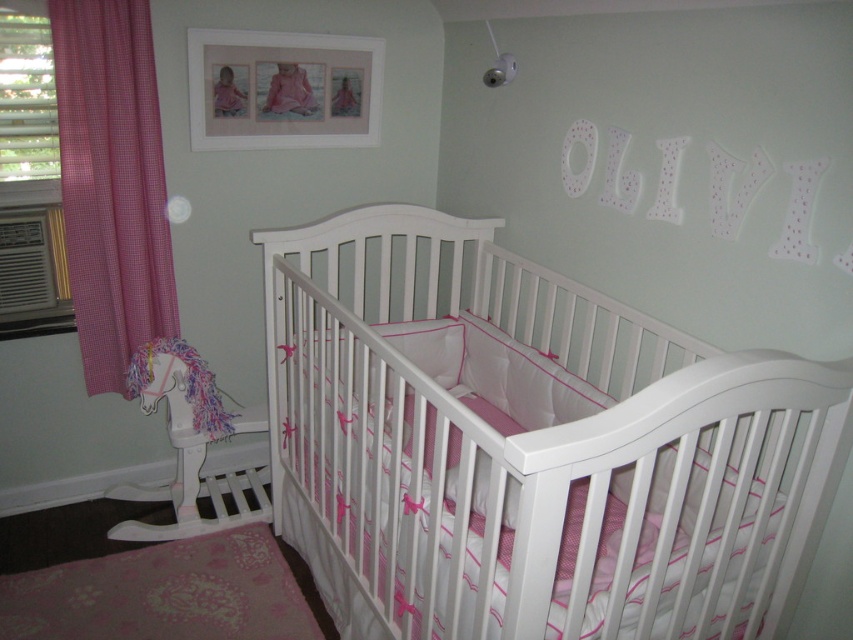
Who is lower down, white glossy crib at center or pink gingham curtain at left?

Positioned lower is white glossy crib at center.

Does point (752, 611) come in front of point (96, 374)?

Yes, it is.

Where is `white glossy crib at center`? white glossy crib at center is located at coordinates (529, 445).

Where is `white glossy crib at center`? white glossy crib at center is located at coordinates (529, 445).

The width and height of the screenshot is (853, 640). What are the coordinates of `white glossy crib at center` in the screenshot? It's located at (529, 445).

Which is behind, point (351, 573) or point (225, 76)?

Point (225, 76)

The width and height of the screenshot is (853, 640). I want to click on white glossy crib at center, so click(x=529, y=445).

Locate an element on the screen. white glossy crib at center is located at coordinates (529, 445).